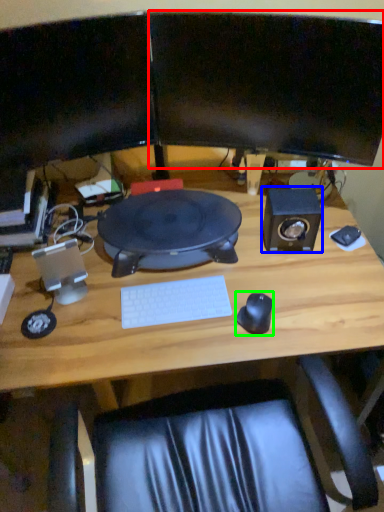
Question: Based on their relative distances, which object is farther from computer monitor (highlighted by a red box)? Choose from speaker (highlighted by a blue box) and mouse (highlighted by a green box).

Choices:
 (A) speaker
 (B) mouse

Answer: (B)